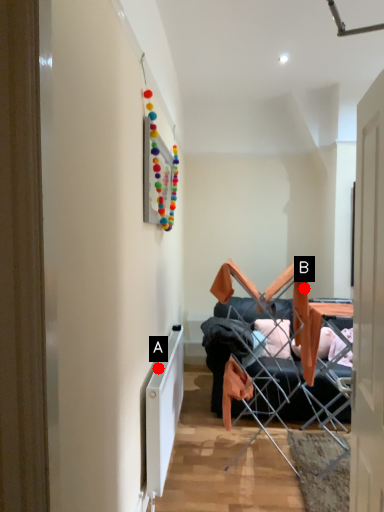
Question: Two points are circled on the image, labeled by A and B beside each circle. Which of the following is the farthest from the observer?

Choices:
 (A) A is further
 (B) B is further

Answer: (B)